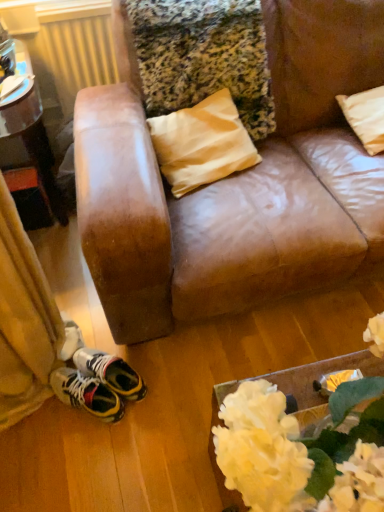
Question: Is metallic yellow radiator at upper left wider than brushed metal table at left?

Choices:
 (A) no
 (B) yes

Answer: (A)

Question: Can you confirm if metallic yellow radiator at upper left is taller than brushed metal table at left?

Choices:
 (A) no
 (B) yes

Answer: (A)

Question: Is metallic yellow radiator at upper left shorter than brushed metal table at left?

Choices:
 (A) yes
 (B) no

Answer: (A)

Question: Is metallic yellow radiator at upper left next to brushed metal table at left and touching it?

Choices:
 (A) yes
 (B) no

Answer: (B)

Question: Is metallic yellow radiator at upper left looking in the opposite direction of brushed metal table at left?

Choices:
 (A) no
 (B) yes

Answer: (A)

Question: In terms of size, does beige fabric pillow at upper right appear bigger or smaller than metallic yellow radiator at upper left?

Choices:
 (A) small
 (B) big

Answer: (A)

Question: Choose the correct answer: Is beige fabric pillow at upper right inside metallic yellow radiator at upper left or outside it?

Choices:
 (A) inside
 (B) outside

Answer: (B)

Question: In the image, is beige fabric pillow at upper right on the left side or the right side of metallic yellow radiator at upper left?

Choices:
 (A) left
 (B) right

Answer: (B)

Question: From a real-world perspective, is beige fabric pillow at upper right physically located above or below metallic yellow radiator at upper left?

Choices:
 (A) above
 (B) below

Answer: (B)

Question: Is beige fabric pillow at upper right bigger or smaller than white fabric flowers at lower right?

Choices:
 (A) small
 (B) big

Answer: (A)

Question: Is beige fabric pillow at upper right taller or shorter than white fabric flowers at lower right?

Choices:
 (A) tall
 (B) short

Answer: (B)

Question: Looking at their shapes, would you say beige fabric pillow at upper right is wider or thinner than white fabric flowers at lower right?

Choices:
 (A) wide
 (B) thin

Answer: (A)

Question: Is point click(347, 114) positioned closer to the camera than point click(359, 456)?

Choices:
 (A) closer
 (B) farther

Answer: (B)

Question: Considering the positions of brushed metal table at left and beige fabric pillow at upper right in the image, is brushed metal table at left bigger or smaller than beige fabric pillow at upper right?

Choices:
 (A) small
 (B) big

Answer: (B)

Question: From a real-world perspective, is brushed metal table at left physically located above or below beige fabric pillow at upper right?

Choices:
 (A) above
 (B) below

Answer: (B)